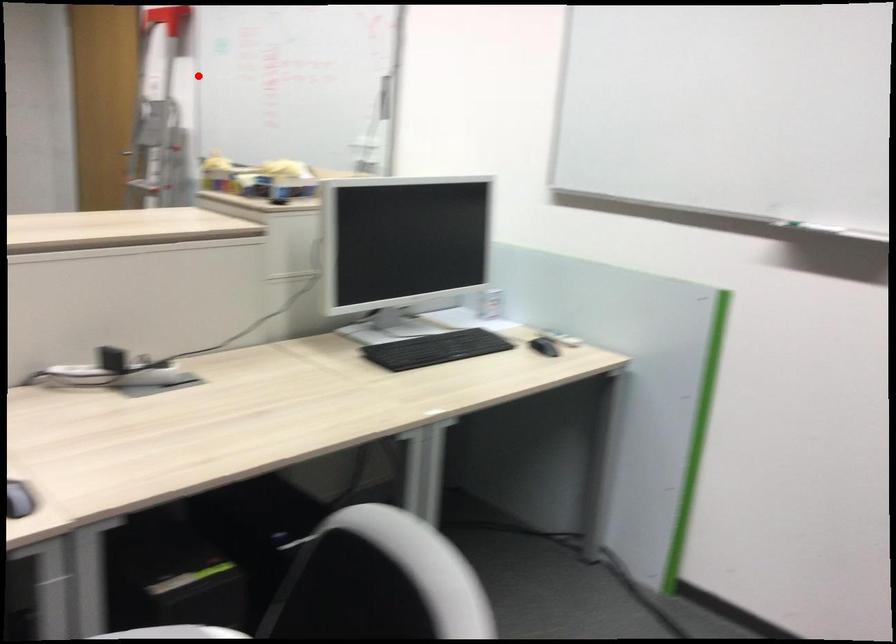
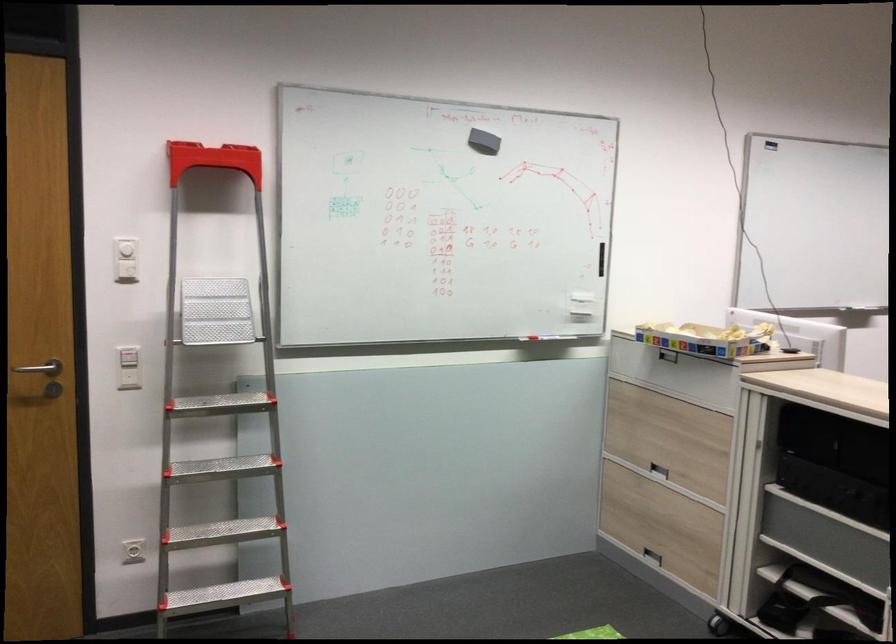
Locate, in the second image, the point that corresponds to the highlighted location in the first image.

(125, 269)